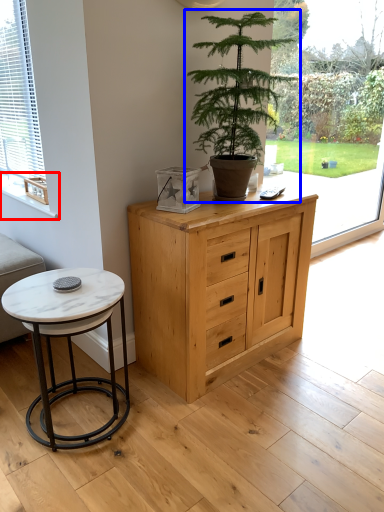
Question: Which point is further to the camera, window sill (highlighted by a red box) or houseplant (highlighted by a blue box)?

Choices:
 (A) window sill
 (B) houseplant

Answer: (A)